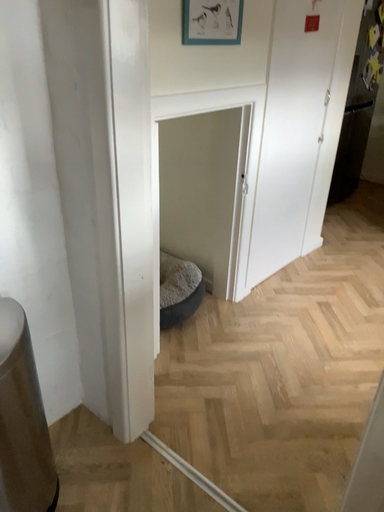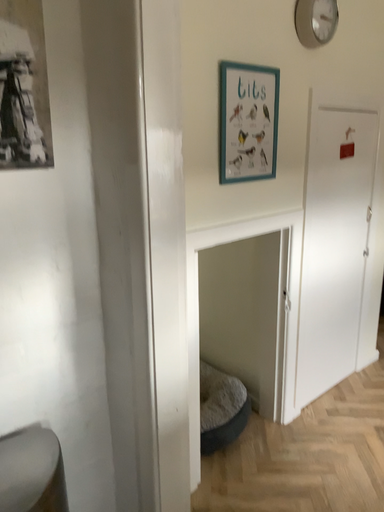
Question: Which way did the camera rotate in the video?

Choices:
 (A) rotated right
 (B) rotated left

Answer: (B)